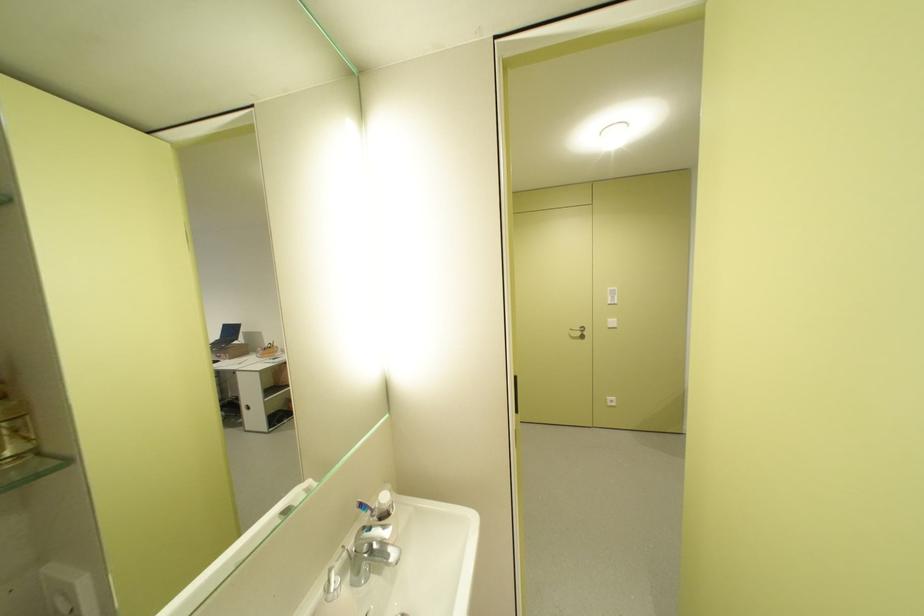
Image resolution: width=924 pixels, height=616 pixels. What do you see at coordinates (612, 294) in the screenshot?
I see `the white light switch` at bounding box center [612, 294].